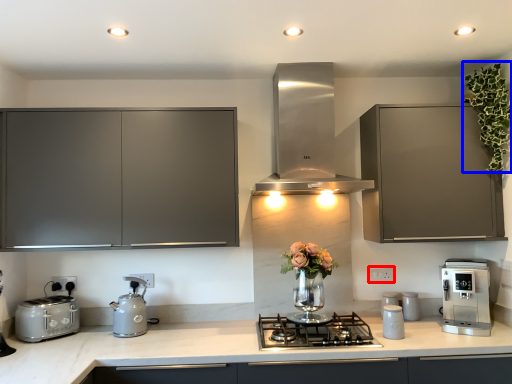
Question: Which point is further to the camera, electric outlet (highlighted by a red box) or floral arrangement (highlighted by a blue box)?

Choices:
 (A) electric outlet
 (B) floral arrangement

Answer: (A)